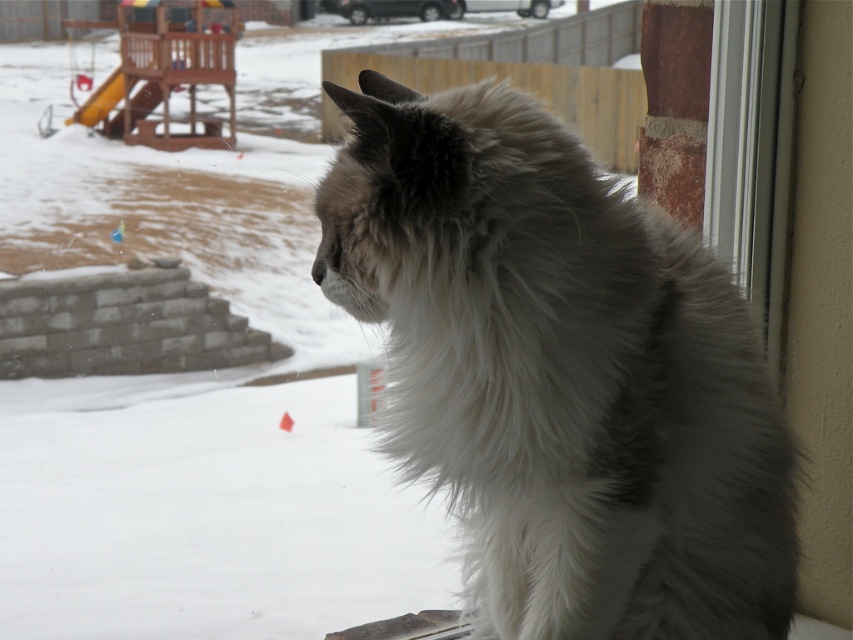
You are a visitor at this house and want to know if the white fluffy cat at right can fit through the clear glass window at upper right. Can it?

The white fluffy cat at right is larger in size than the clear glass window at upper right, so it cannot fit through the window.